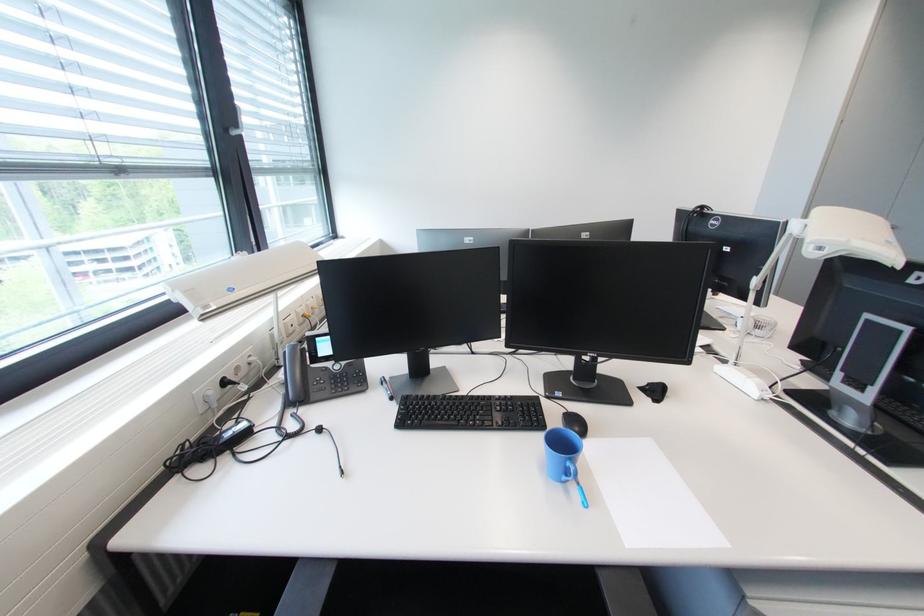
Find where to adjust the white lamp head. Please return your answer as a coordinate pair (x, y).

(849, 236)